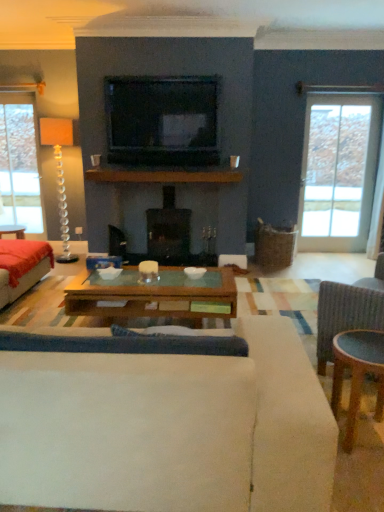
Question: From the image's perspective, is velvet red couch at left, the second studio couch viewed from the front, positioned above or below white fabric studio couch at center, the 1th studio couch in the right-to-left sequence?

Choices:
 (A) above
 (B) below

Answer: (A)

Question: Visually, is velvet red couch at left, which appears as the first studio couch when viewed from the back, positioned to the left or to the right of white fabric studio couch at center, placed as the 2th studio couch when sorted from back to front?

Choices:
 (A) left
 (B) right

Answer: (A)

Question: Estimate the real-world distances between objects in this image. Which object is farther from the wooden glass coffee table at center?

Choices:
 (A) clear glass door at right
 (B) clear glass lamp at left
 (C) black glass fireplace at center
 (D) white fabric studio couch at center, the 1th studio couch in the right-to-left sequence
 (E) black glossy television at upper center

Answer: (B)

Question: Which object is positioned farthest from the black glass fireplace at center?

Choices:
 (A) wooden glass coffee table at center
 (B) velvet red couch at left, acting as the 1th studio couch starting from the left
 (C) black glossy television at upper center
 (D) white fabric studio couch at center, which is the second studio couch from left to right
 (E) clear glass door at right

Answer: (D)